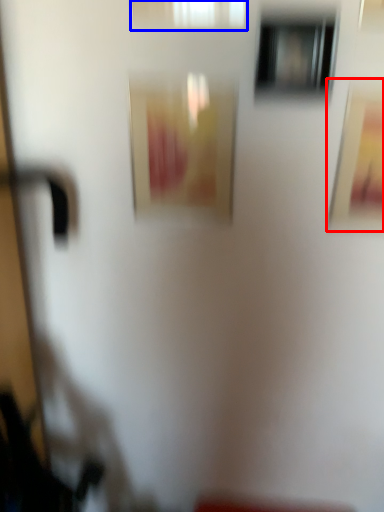
Question: Which object appears closest to the camera in this image, picture frame (highlighted by a red box) or window (highlighted by a blue box)?

Choices:
 (A) picture frame
 (B) window

Answer: (B)